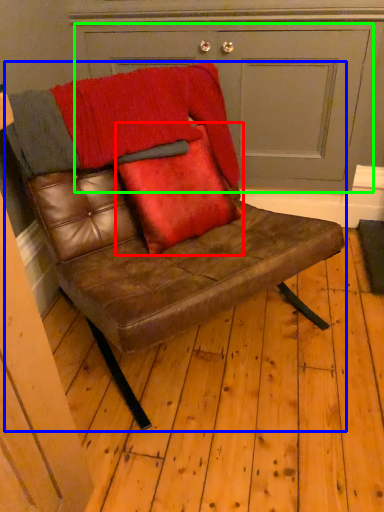
Question: Which object is positioned farthest from throw pillow (highlighted by a red box)? Select from chair (highlighted by a blue box) and door (highlighted by a green box).

Choices:
 (A) chair
 (B) door

Answer: (B)